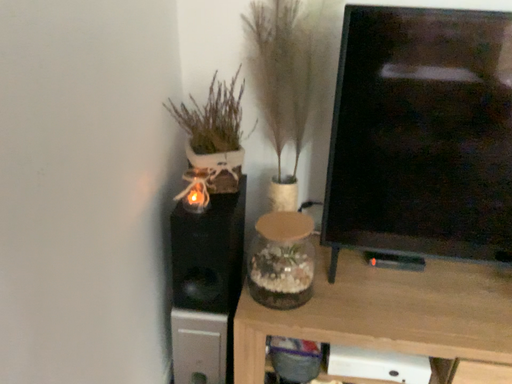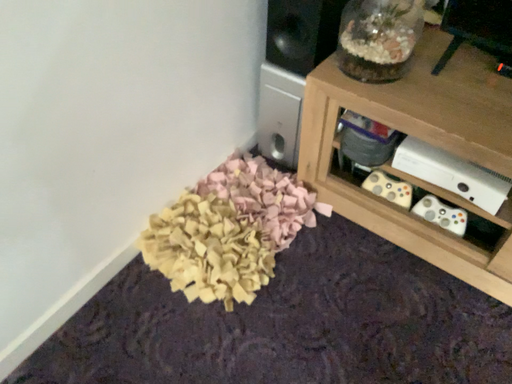
Question: How did the camera likely rotate when shooting the video?

Choices:
 (A) rotated right
 (B) rotated left

Answer: (B)